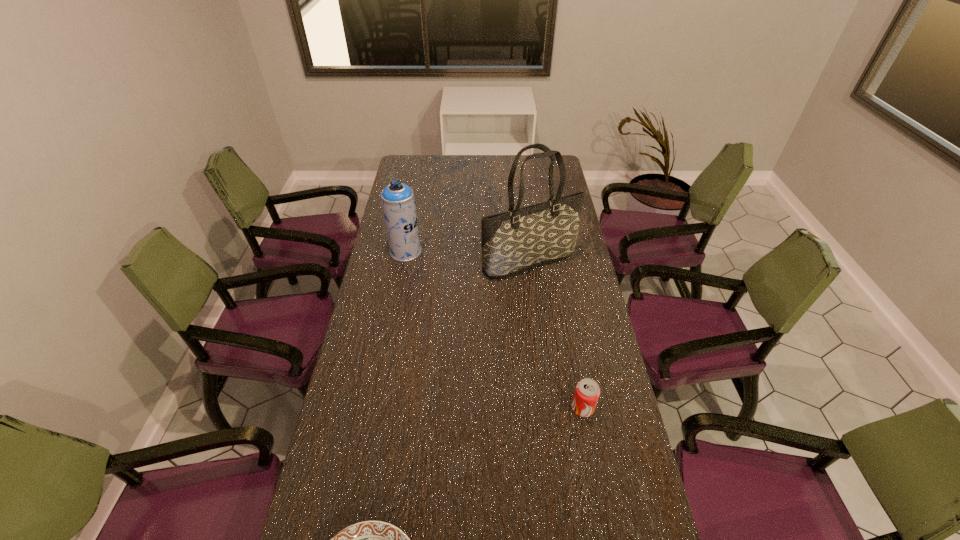
In the image, there is a desktop. Where is `free space at the far edge`? This screenshot has height=540, width=960. free space at the far edge is located at coordinates (435, 176).

The width and height of the screenshot is (960, 540). In the image, there is a desktop. What are the coordinates of `vacant space at the left edge` in the screenshot? It's located at (343, 459).

In order to click on vacant space at the right edge of the desktop in this screenshot , I will do `click(622, 514)`.

Locate an element on the screen. This screenshot has height=540, width=960. free space at the far left corner is located at coordinates click(421, 171).

Locate an element on the screen. vacant area between the third tallest object and the tallest object is located at coordinates (556, 335).

This screenshot has width=960, height=540. Find the location of `vacant space that's between the soda can and the tote bag`. vacant space that's between the soda can and the tote bag is located at coordinates (556, 335).

Identify which object is located as the second nearest to the tote bag. Please provide its 2D coordinates. Your answer should be formatted as a tuple, i.e. [(x, y)], where the tuple contains the x and y coordinates of a point satisfying the conditions above.

[(587, 391)]

In order to click on the second closest object relative to the plate in this screenshot , I will do `click(523, 238)`.

Where is `free space that satisfies the following two spatial constraints: 1. on the front side of the tallest object; 2. on the left side of the soda can`? Image resolution: width=960 pixels, height=540 pixels. free space that satisfies the following two spatial constraints: 1. on the front side of the tallest object; 2. on the left side of the soda can is located at coordinates (546, 408).